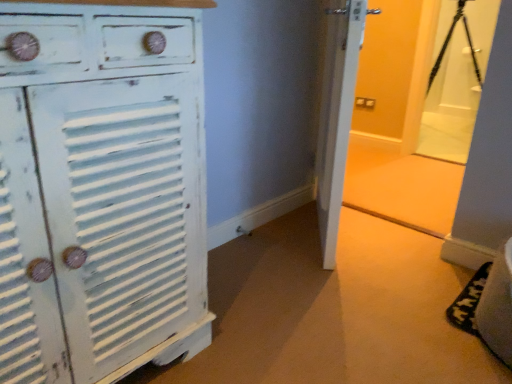
Question: Is distressed white cabinet at left not inside black matte tripod at upper right?

Choices:
 (A) no
 (B) yes

Answer: (B)

Question: Does distressed white cabinet at left have a lesser width compared to black matte tripod at upper right?

Choices:
 (A) no
 (B) yes

Answer: (A)

Question: From a real-world perspective, is distressed white cabinet at left over black matte tripod at upper right?

Choices:
 (A) no
 (B) yes

Answer: (A)

Question: Can you confirm if distressed white cabinet at left is positioned to the right of black matte tripod at upper right?

Choices:
 (A) yes
 (B) no

Answer: (B)

Question: Considering the relative sizes of distressed white cabinet at left and black matte tripod at upper right in the image provided, is distressed white cabinet at left wider than black matte tripod at upper right?

Choices:
 (A) no
 (B) yes

Answer: (B)

Question: Is black matte tripod at upper right at the back of distressed white cabinet at left?

Choices:
 (A) no
 (B) yes

Answer: (A)

Question: Is black matte tripod at upper right wider than distressed white cabinet at left?

Choices:
 (A) no
 (B) yes

Answer: (A)

Question: Is distressed white cabinet at left a part of black matte tripod at upper right?

Choices:
 (A) no
 (B) yes

Answer: (A)

Question: Considering the relative sizes of black matte tripod at upper right and distressed white cabinet at left in the image provided, is black matte tripod at upper right thinner than distressed white cabinet at left?

Choices:
 (A) yes
 (B) no

Answer: (A)

Question: Is black matte tripod at upper right located outside distressed white cabinet at left?

Choices:
 (A) yes
 (B) no

Answer: (A)

Question: Is black matte tripod at upper right behind distressed white cabinet at left?

Choices:
 (A) yes
 (B) no

Answer: (A)

Question: Can you confirm if black matte tripod at upper right is bigger than distressed white cabinet at left?

Choices:
 (A) yes
 (B) no

Answer: (B)

Question: Is distressed white cabinet at left to the left or to the right of black matte tripod at upper right in the image?

Choices:
 (A) left
 (B) right

Answer: (A)